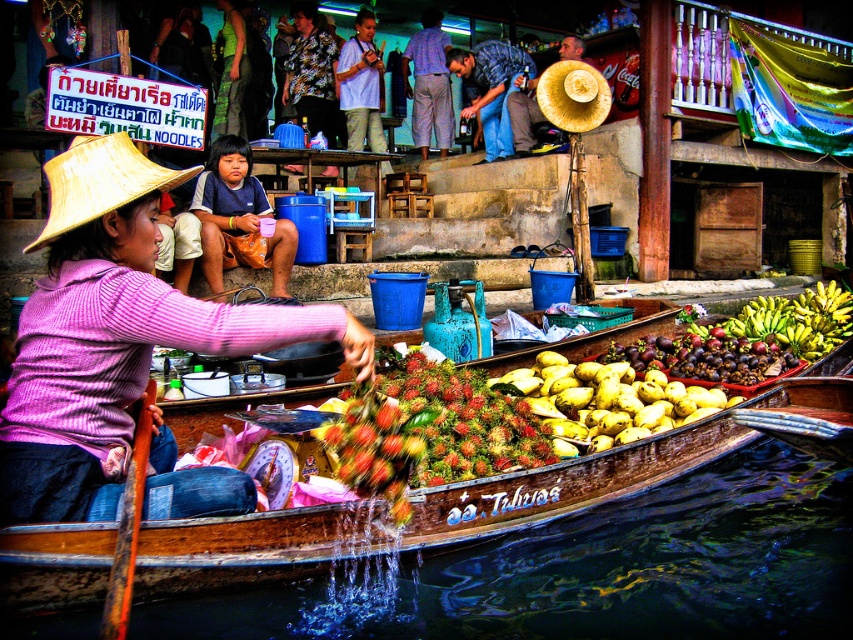
Can you confirm if pink striped sweater at left is wider than green rubber bananas at right?

Incorrect, pink striped sweater at left's width does not surpass green rubber bananas at right's.

Between pink striped sweater at left and green rubber bananas at right, which one is positioned lower?

pink striped sweater at left

I want to click on pink striped sweater at left, so click(x=114, y=333).

Can you confirm if floral shirt at upper center is positioned to the right of natural straw hat at upper center?

Incorrect, floral shirt at upper center is not on the right side of natural straw hat at upper center.

From the picture: Can you confirm if floral shirt at upper center is positioned to the left of natural straw hat at upper center?

Correct, you'll find floral shirt at upper center to the left of natural straw hat at upper center.

Locate an element on the screen. The image size is (853, 640). floral shirt at upper center is located at coordinates (311, 72).

Locate an element on the screen. floral shirt at upper center is located at coordinates (311, 72).

Can you confirm if yellow matte mangoes at center is smaller than matte brown straw hat at upper left?

Yes, yellow matte mangoes at center is smaller than matte brown straw hat at upper left.

Where is `yellow matte mangoes at center`? The image size is (853, 640). yellow matte mangoes at center is located at coordinates (608, 401).

Is point (572, 401) positioned in front of point (251, 186)?

Yes, point (572, 401) is closer to viewer.

I want to click on yellow matte mangoes at center, so click(x=608, y=401).